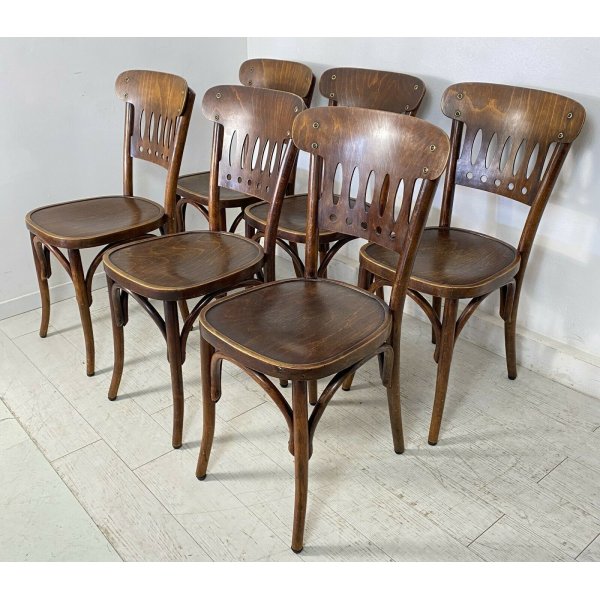
Find the location of a particular element. This screenshot has width=600, height=600. chairs is located at coordinates (459, 269), (375, 91), (286, 71), (268, 115), (389, 152), (157, 105).